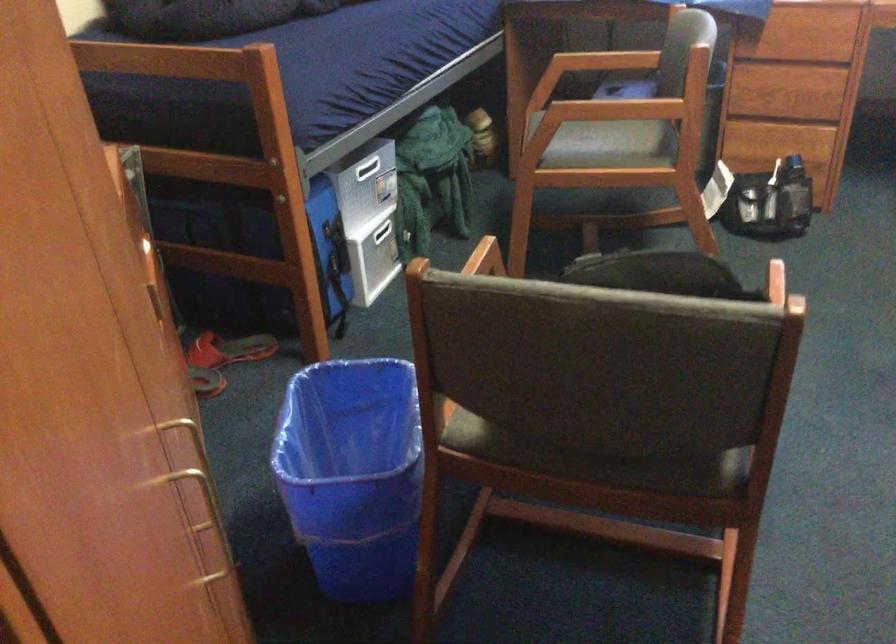
You are a GUI agent. You are given a task and a screenshot of the screen. Output one action in this format:
    pyautogui.click(x=<x>, y=<y>)
    Task: Click on the blue trash can
    
    Given the screenshot: What is the action you would take?
    pyautogui.click(x=352, y=474)